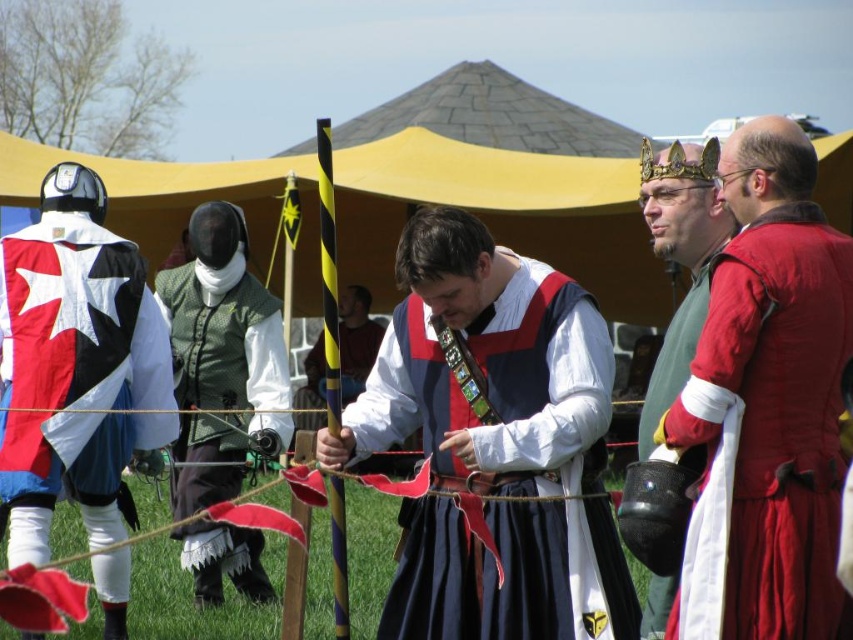
Looking at this image, between matte red vest at center and matte gold crown at upper right, which one appears on the left side from the viewer's perspective?

matte red vest at center

Looking at this image, is matte red vest at center to the left of matte gold crown at upper right from the viewer's perspective?

Correct, you'll find matte red vest at center to the left of matte gold crown at upper right.

Describe the element at coordinates (498, 385) in the screenshot. The image size is (853, 640). I see `matte red vest at center` at that location.

You are a GUI agent. You are given a task and a screenshot of the screen. Output one action in this format:
    pyautogui.click(x=<x>, y=<y>)
    Task: Click on the matte red vest at center
    
    Given the screenshot: What is the action you would take?
    pyautogui.click(x=498, y=385)

Which of these two, white cotton tunic at center or matte yellow pole at center, stands taller?

Standing taller between the two is white cotton tunic at center.

Who is shorter, white cotton tunic at center or matte yellow pole at center?

matte yellow pole at center is shorter.

Does point (18, 307) come closer to viewer compared to point (299, 392)?

Yes.

Locate an element on the screen. The width and height of the screenshot is (853, 640). white cotton tunic at center is located at coordinates (74, 376).

Is matte red vest at center closer to camera compared to white cotton tunic at center?

That is True.

This screenshot has width=853, height=640. Find the location of `matte red vest at center`. matte red vest at center is located at coordinates (498, 385).